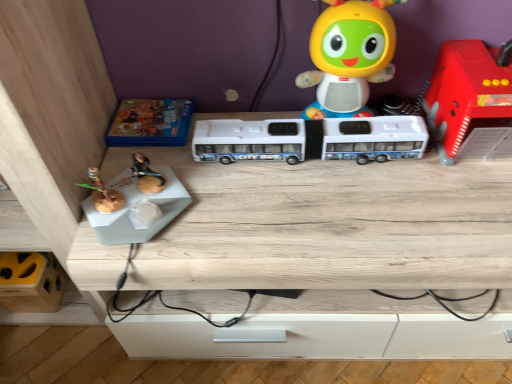
You are a GUI agent. You are given a task and a screenshot of the screen. Output one action in this format:
    pyautogui.click(x=<x>, y=<y>)
    Task: Click on the vacant area located to the right-hand side of white plastic bus at center, the 3th toy positioned from the left
    
    Given the screenshot: What is the action you would take?
    pyautogui.click(x=426, y=183)